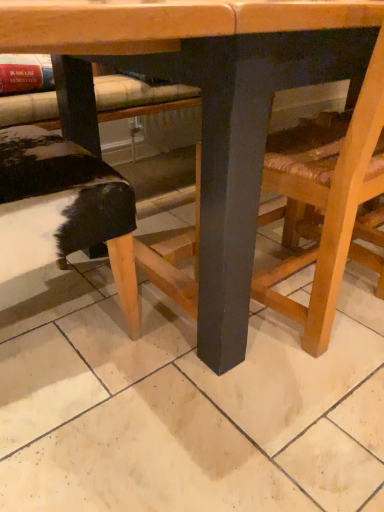
The height and width of the screenshot is (512, 384). Identify the location of vacant point to the right of black furry cushion at lower left. (170, 357).